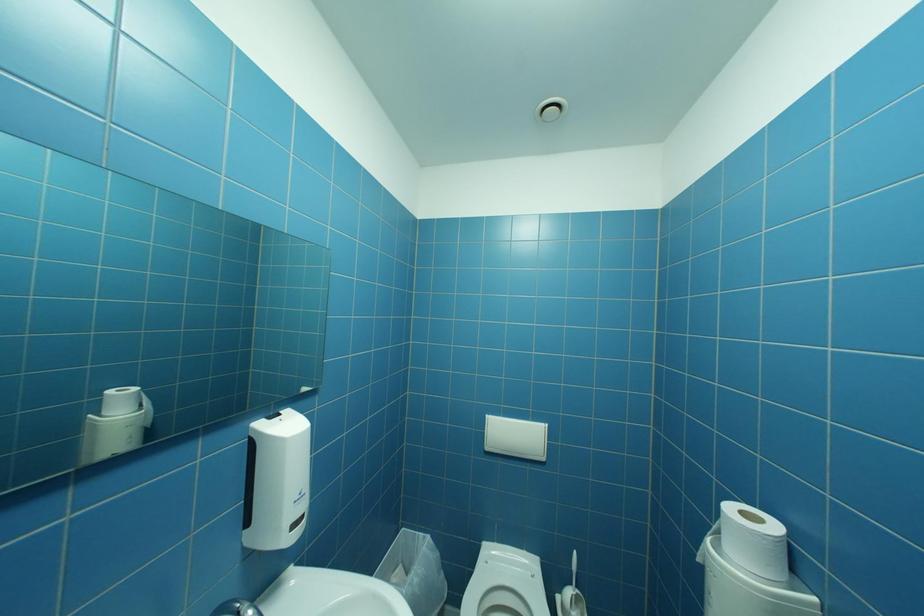
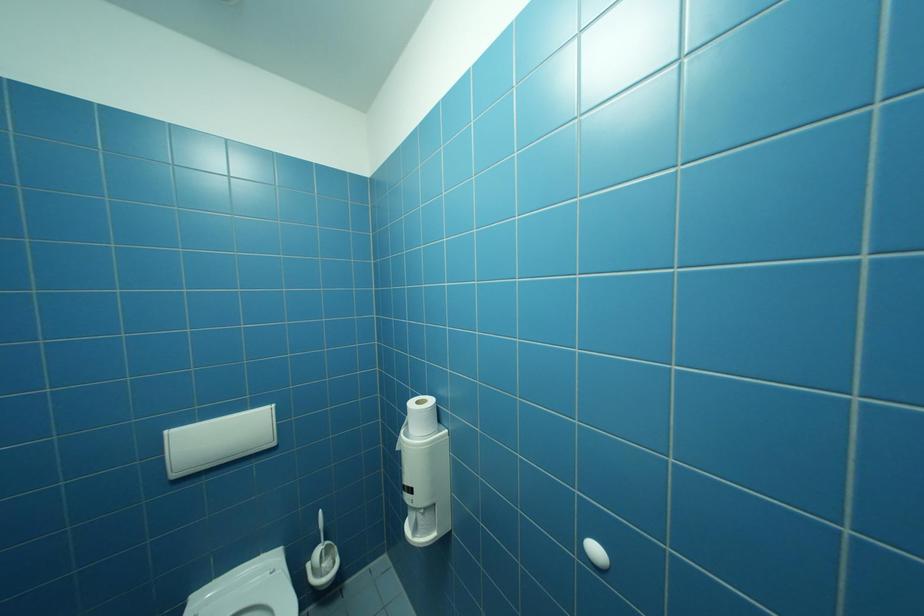
Question: Based on the continuous images, in which direction is the camera rotating? Reply with the corresponding letter.

Choices:
 (A) Left
 (B) Right
 (C) Up
 (D) Down

Answer: (B)